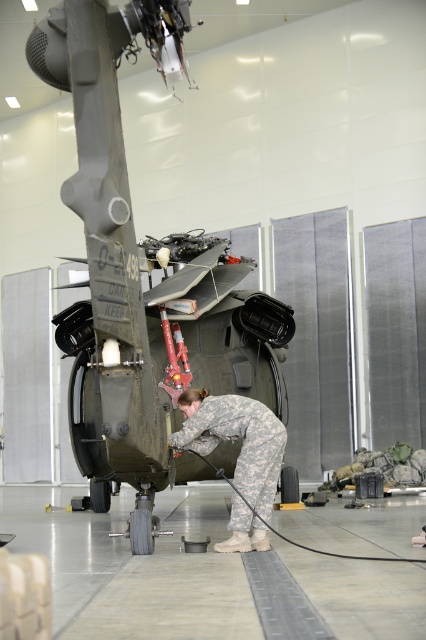
Question: Observing the image, what is the correct spatial positioning of green matte helicopter at center in reference to camouflage uniform at center?

Choices:
 (A) above
 (B) below

Answer: (A)

Question: Which of the following is the closest to the observer?

Choices:
 (A) (264, 508)
 (B) (249, 461)

Answer: (B)

Question: Does green matte helicopter at center have a greater width compared to camouflage uniform at center?

Choices:
 (A) yes
 (B) no

Answer: (A)

Question: Does green matte helicopter at center appear under camouflage uniform at center?

Choices:
 (A) yes
 (B) no

Answer: (B)